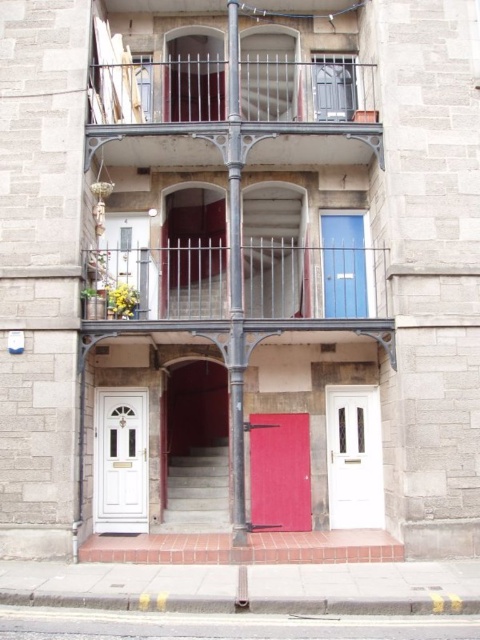
You are a delivery person trying to deliver a package to the blue matte door at center. You have a large box that is 2 meters tall. Can the box fit through the white glossy door at lower left?

The white glossy door at lower left is much taller than the blue matte door at center. Since the box is 2 meters tall, it may fit through the white glossy door at lower left if its height is sufficient. However, without knowing the exact height of the door, we cannot confirm for certain. Please measure the door height before attempting to pass the box through.

You are standing in front of the building and want to enter through the white glass door at center. Which direction should you move relative to the matte red door at center?

You should move to the right of the matte red door at center to reach the white glass door at center.

Based on the photo, you are standing in front of the residential building and want to take a photo. You notice two points marked in the image. Which point, point 1 at coordinates (x=146, y=509) or point 2 at coordinates (x=346, y=292), would appear larger in your camera view?

Point 1 at coordinates (x=146, y=509) would appear larger in your camera view because it is closer to the viewer than point 2 at coordinates (x=346, y=292).